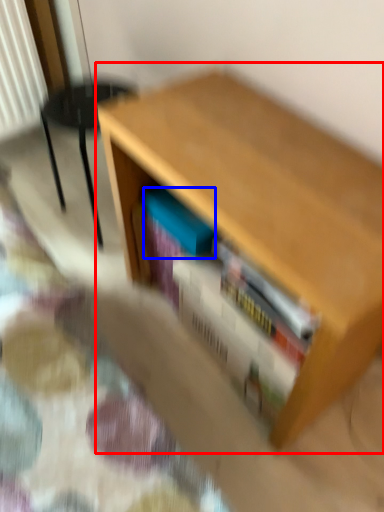
Question: Among these objects, which one is farthest to the camera, table (highlighted by a red box) or paperback book (highlighted by a blue box)?

Choices:
 (A) table
 (B) paperback book

Answer: (B)